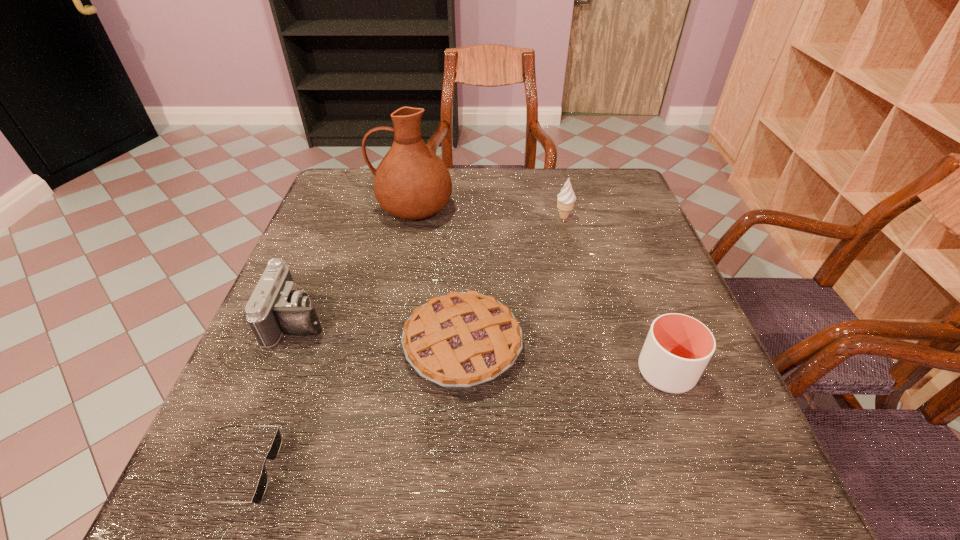
Identify the location of vacant region that satisfies the following two spatial constraints: 1. at the front of the camera with an open lens cover; 2. on the right side of the pie. (289, 346).

The height and width of the screenshot is (540, 960). What are the coordinates of `free space that satisfies the following two spatial constraints: 1. on the front side of the pie; 2. on the left side of the rightmost object` in the screenshot? It's located at 462,372.

I want to click on vacant area that satisfies the following two spatial constraints: 1. at the front of the second shortest object with an open lens cover; 2. on the right side of the camera, so click(289, 346).